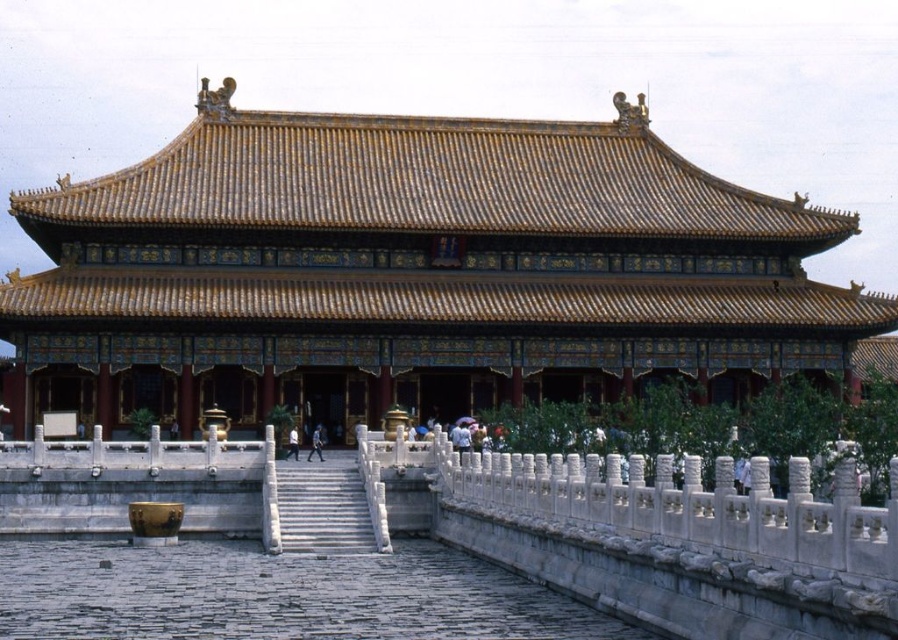
You are a tourist standing at the bottom of the white marble stairs at center leading to the golden glazed tile palace at center. Can you directly see the entrance of the palace from your current position?

Yes, because the golden glazed tile palace at center is above the white marble stairs at center, so the entrance of the palace would be visible from the bottom of the stairs.

You are standing in the courtyard of the Forbidden City and want to take a photo of the golden glazed tile palace at center. If your camera can only focus on objects within a 0.45 radius from the center point, will the palace be in focus?

The golden glazed tile palace at center is located at point (x=414, y=269), which is within the 0.45 radius from the center point, so it will be in focus.